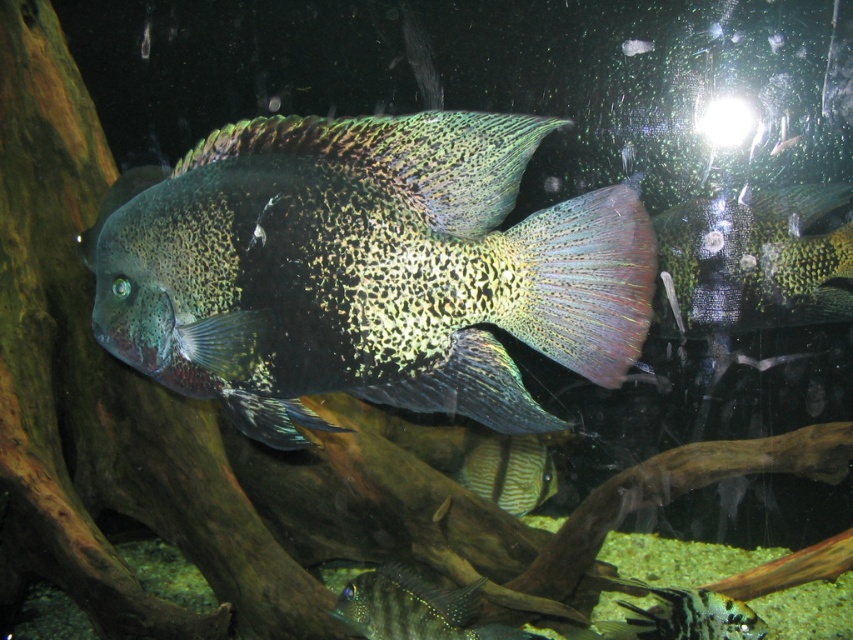
You are an underwater photographer aiming to capture a closeup shot of the shiny iridescent fish at center and the green iridescent fish at right. Since your camera can only focus on one fish at a time, which fish should you choose if you want to ensure the subject is fully in frame without cropping?

The shiny iridescent fish at center has a greater height compared to the green iridescent fish at right. Therefore, choosing the shiny iridescent fish at center would require a larger frame to accommodate its height, while the green iridescent fish at right is smaller and more likely to fit within the camera frame without cropping.

You are an underwater photographer aiming to capture a clear shot of the striped leather fish at center. However, the green iridescent fish at right is blocking your view. Can you move around to the left side of the aquarium to get an unobstructed view?

The green iridescent fish at right is closer to the viewer than the striped leather fish at center, so moving to the left side of the aquarium might allow you to see around the green fish and capture the striped leather fish at center without obstruction.

You are a marine biologist observing an underwater scene in an aquarium. You notice the green iridescent fish at right. If you want to take a closer look without disturbing the fish, which direction should you move relative to the aquarium?

The green iridescent fish at right is 5.47 feet away from the camera. To get closer to the fish without disturbing it, you should move towards the aquarium from the direction of the camera, which would be towards the right side of the aquarium where the fish is located.